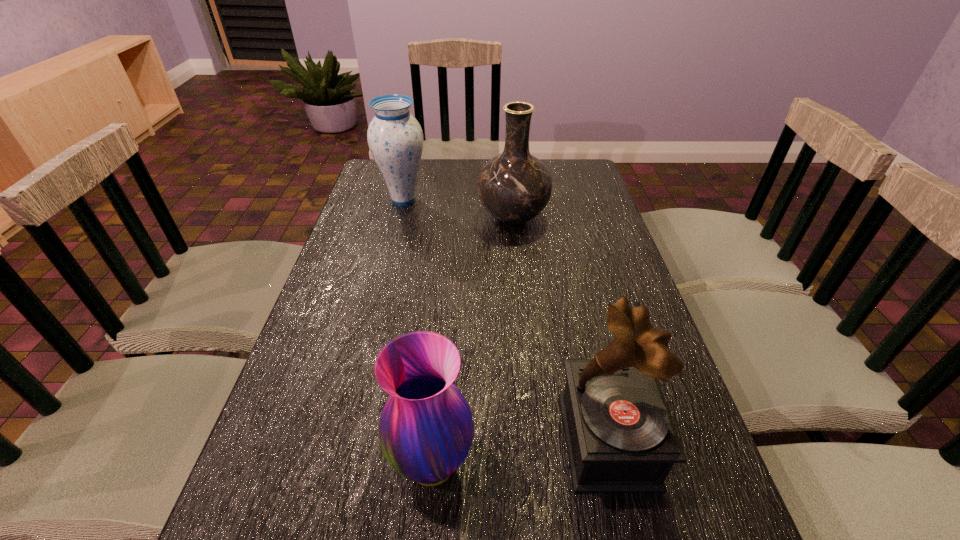
You are a GUI agent. You are given a task and a screenshot of the screen. Output one action in this format:
    pyautogui.click(x=<x>, y=<y>)
    Task: Click on the rightmost vase
    This screenshot has width=960, height=540.
    Given the screenshot: What is the action you would take?
    pyautogui.click(x=514, y=187)

This screenshot has width=960, height=540. I want to click on the leftmost vase, so (x=395, y=138).

Find the location of a particular element. phonograph_record is located at coordinates (620, 436).

Locate an element on the screen. the nearest vase is located at coordinates (426, 429).

Where is `the second object from left to right`? This screenshot has width=960, height=540. the second object from left to right is located at coordinates (426, 429).

Where is `vacant space located on the left of the rightmost vase`? vacant space located on the left of the rightmost vase is located at coordinates (358, 218).

The width and height of the screenshot is (960, 540). In order to click on free space located 0.080m on the back of the leftmost vase in this screenshot , I will do `click(409, 176)`.

You are a GUI agent. You are given a task and a screenshot of the screen. Output one action in this format:
    pyautogui.click(x=<x>, y=<y>)
    Task: Click on the blank area located 0.230m at the horn opening of the phonograph_record
    This screenshot has width=960, height=540.
    Given the screenshot: What is the action you would take?
    pyautogui.click(x=443, y=441)

At what (x,y) coordinates should I click in order to perform the action: click on blank space located at the horn opening of the phonograph_record. Please return your answer as a coordinate pair (x, y). Looking at the image, I should click on (480, 441).

The height and width of the screenshot is (540, 960). Identify the location of free space located 0.110m at the horn opening of the phonograph_record. (506, 441).